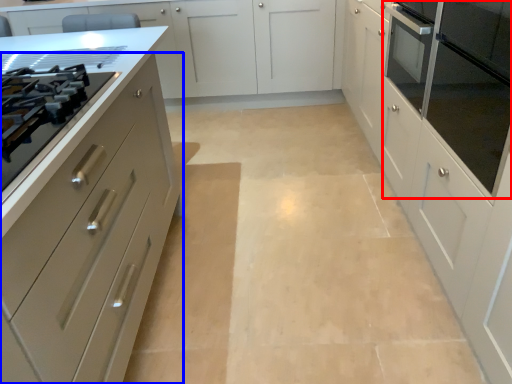
Question: Which of the following is the farthest to the observer, home appliance (highlighted by a red box) or cabinetry (highlighted by a blue box)?

Choices:
 (A) home appliance
 (B) cabinetry

Answer: (A)